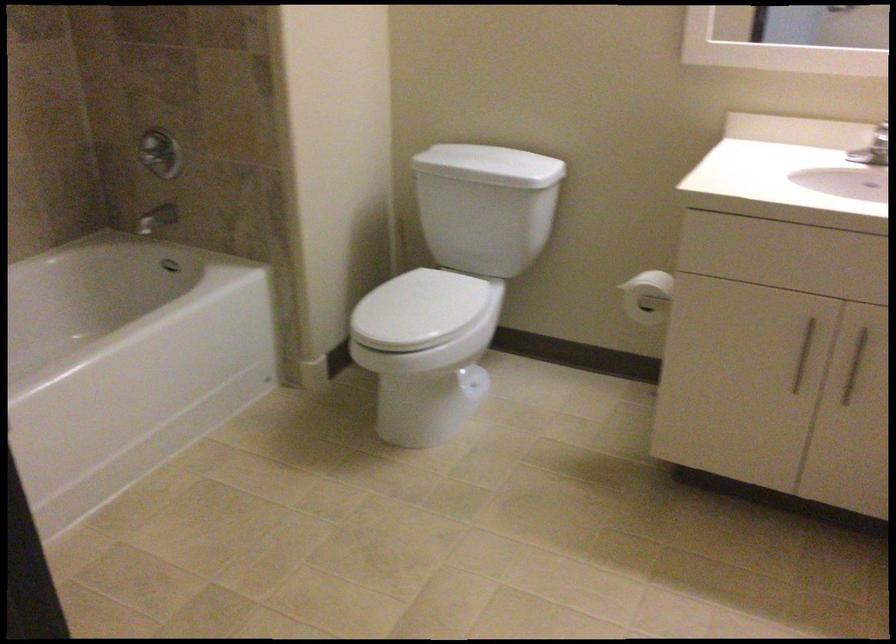
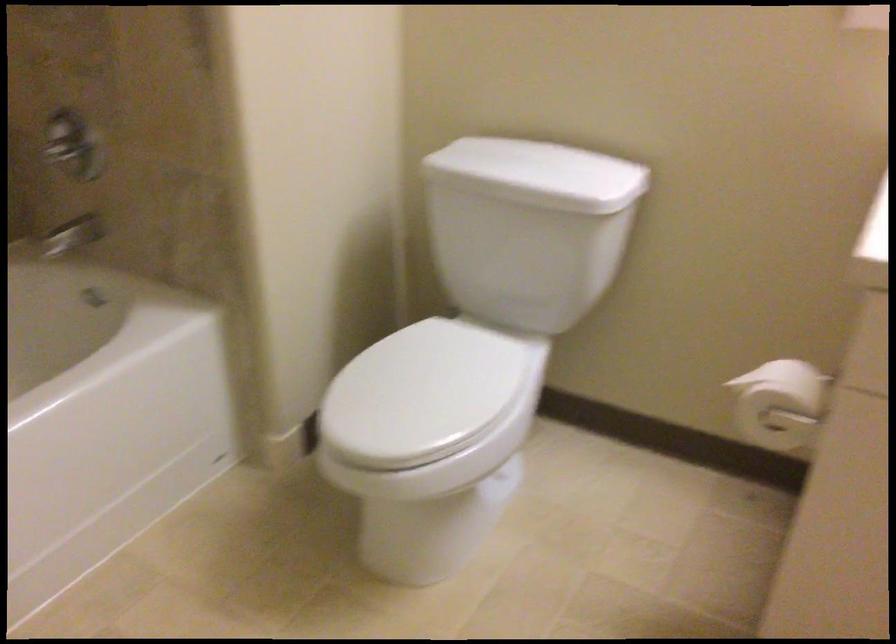
Question: In a continuous first-person perspective shot, in which direction is the camera moving?

Choices:
 (A) Left
 (B) Right
 (C) Forward
 (D) Backward

Answer: (C)